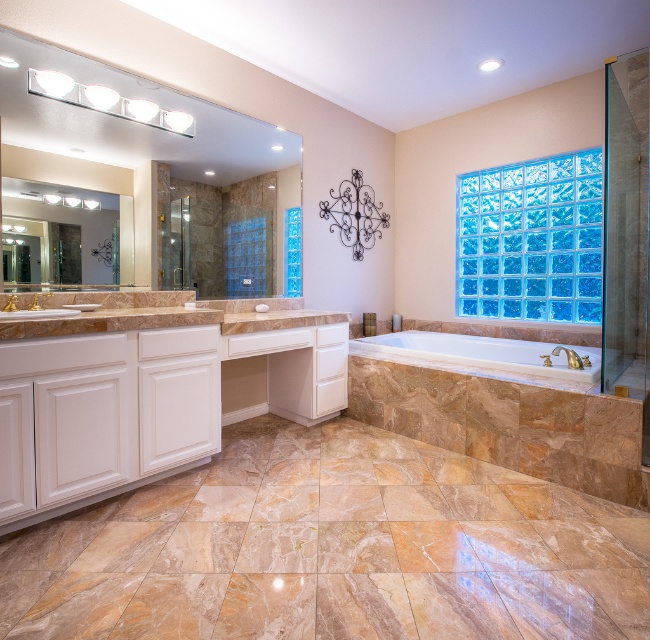
You are designing a bathroom layout and need to place a large plant that requires 1 meter of space. You see the matte glass mirror at upper left and the gold metallic faucet at center. Which object has enough space around it to accommodate the plant?

The matte glass mirror at upper left has a larger size compared to the gold metallic faucet at center, so it likely has more space around it to accommodate the plant requiring 1 meter of space.

You are standing in the bathroom and want to take a clear photo of the white marble bathtub at center with your phone camera. Considering the distance between you and the bathtub, can you capture the entire bathtub in the frame without moving closer?

The white marble bathtub at center and camera are 8.65 feet apart. At this distance, it is possible to capture the entire white marble bathtub at center in the frame using a standard phone camera without needing to move closer.

You are a guest in this bathroom and want to wash your hands. The gold metallic faucet at center is where you need to go. Is the matte glass mirror at upper left above or below the faucet?

The matte glass mirror at upper left is located above the gold metallic faucet at center, so it is above the faucet.